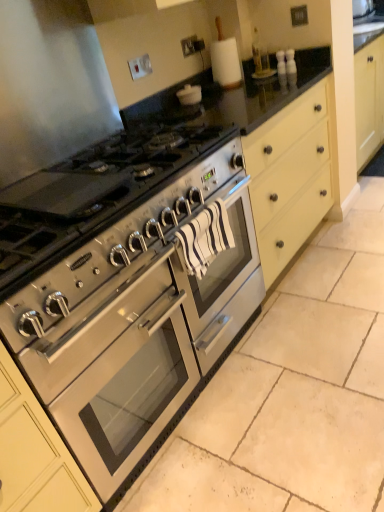
Where is `stainless steel oven at center`? stainless steel oven at center is located at coordinates (117, 371).

The width and height of the screenshot is (384, 512). Describe the element at coordinates (117, 371) in the screenshot. I see `stainless steel oven at center` at that location.

Image resolution: width=384 pixels, height=512 pixels. What do you see at coordinates (92, 194) in the screenshot?
I see `satin silver gas stove at center` at bounding box center [92, 194].

Locate an element on the screen. This screenshot has height=512, width=384. satin silver gas stove at center is located at coordinates (92, 194).

Based on the photo, measure the distance between satin silver gas stove at center and camera.

satin silver gas stove at center and camera are 36.44 inches apart from each other.

At what (x,y) coordinates should I click in order to perform the action: click on stainless steel oven at center. Please return your answer as a coordinate pair (x, y). Image resolution: width=384 pixels, height=512 pixels. Looking at the image, I should click on (117, 371).

Considering the positions of objects stainless steel oven at center and satin silver gas stove at center in the image provided, who is more to the right, stainless steel oven at center or satin silver gas stove at center?

stainless steel oven at center is more to the right.

Is stainless steel oven at center in front of or behind satin silver gas stove at center in the image?

In the image, stainless steel oven at center appears behind satin silver gas stove at center.

Which is less distant, (143, 349) or (10, 190)?

Point (143, 349).

From the image's perspective, who appears lower, stainless steel oven at center or satin silver gas stove at center?

stainless steel oven at center.

From a real-world perspective, which is physically above, stainless steel oven at center or satin silver gas stove at center?

In real-world perspective, satin silver gas stove at center is above.

From the picture: Between stainless steel oven at center and satin silver gas stove at center, which one has smaller width?

Thinner between the two is satin silver gas stove at center.

Considering the relative sizes of stainless steel oven at center and satin silver gas stove at center in the image provided, is stainless steel oven at center taller than satin silver gas stove at center?

Yes, stainless steel oven at center is taller than satin silver gas stove at center.

Is stainless steel oven at center bigger or smaller than satin silver gas stove at center?

Considering their sizes, stainless steel oven at center takes up more space than satin silver gas stove at center.

Can we say stainless steel oven at center lies outside satin silver gas stove at center?

Yes, stainless steel oven at center is located beyond the bounds of satin silver gas stove at center.

Is stainless steel oven at center positioned far away from satin silver gas stove at center?

No, stainless steel oven at center is not far from satin silver gas stove at center.

Is stainless steel oven at center looking in the opposite direction of satin silver gas stove at center?

No, satin silver gas stove at center is not at the back of stainless steel oven at center.

How different are the orientations of stainless steel oven at center and satin silver gas stove at center in degrees?

The angle between the facing direction of stainless steel oven at center and the facing direction of satin silver gas stove at center is 0.00105 degrees.

Measure the distance between stainless steel oven at center and satin silver gas stove at center.

They are 17.43 inches apart.

Find the location of a particular element. This screenshot has height=512, width=384. oven beneath the satin silver gas stove at center (from a real-world perspective) is located at coordinates (117, 371).

Is satin silver gas stove at center to the left of stainless steel oven at center from the viewer's perspective?

Yes, satin silver gas stove at center is to the left of stainless steel oven at center.

Considering the relative positions of satin silver gas stove at center and stainless steel oven at center in the image provided, is satin silver gas stove at center in front of stainless steel oven at center?

Yes.

Which point is more forward, (84, 228) or (178, 347)?

The point (84, 228) is closer to the camera.

From the image's perspective, is satin silver gas stove at center located beneath stainless steel oven at center?

Actually, satin silver gas stove at center appears above stainless steel oven at center in the image.

From a real-world perspective, is satin silver gas stove at center positioned over stainless steel oven at center based on gravity?

Yes, from a real-world perspective, satin silver gas stove at center is on top of stainless steel oven at center.

Can you confirm if satin silver gas stove at center is thinner than stainless steel oven at center?

Yes.

Considering the sizes of satin silver gas stove at center and stainless steel oven at center in the image, is satin silver gas stove at center taller or shorter than stainless steel oven at center?

Considering their sizes, satin silver gas stove at center has less height than stainless steel oven at center.

Is satin silver gas stove at center smaller than stainless steel oven at center?

Correct, satin silver gas stove at center occupies less space than stainless steel oven at center.

Is stainless steel oven at center completely or partially inside satin silver gas stove at center?

No, stainless steel oven at center is not surrounded by satin silver gas stove at center.

Is there a large distance between satin silver gas stove at center and stainless steel oven at center?

No, satin silver gas stove at center is not far from stainless steel oven at center.

Could you tell me if satin silver gas stove at center is turned towards stainless steel oven at center?

No, satin silver gas stove at center is not facing towards stainless steel oven at center.

Can you tell me how much satin silver gas stove at center and stainless steel oven at center differ in facing direction?

They differ by 0.00105 degrees in their facing directions.

Identify the location of gas stove that is above the stainless steel oven at center (from a real-world perspective). The height and width of the screenshot is (512, 384). (92, 194).

Locate an element on the screen. Image resolution: width=384 pixels, height=512 pixels. oven on the right of satin silver gas stove at center is located at coordinates (117, 371).

Image resolution: width=384 pixels, height=512 pixels. I want to click on gas stove that is on the left side of stainless steel oven at center, so click(x=92, y=194).